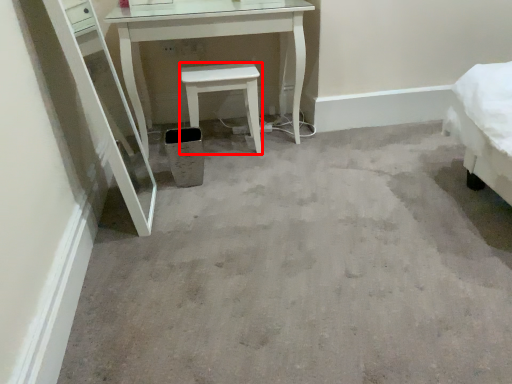
Question: From the image's perspective, where is stool (annotated by the red box) located in relation to trash bin/can in the image?

Choices:
 (A) above
 (B) below

Answer: (A)